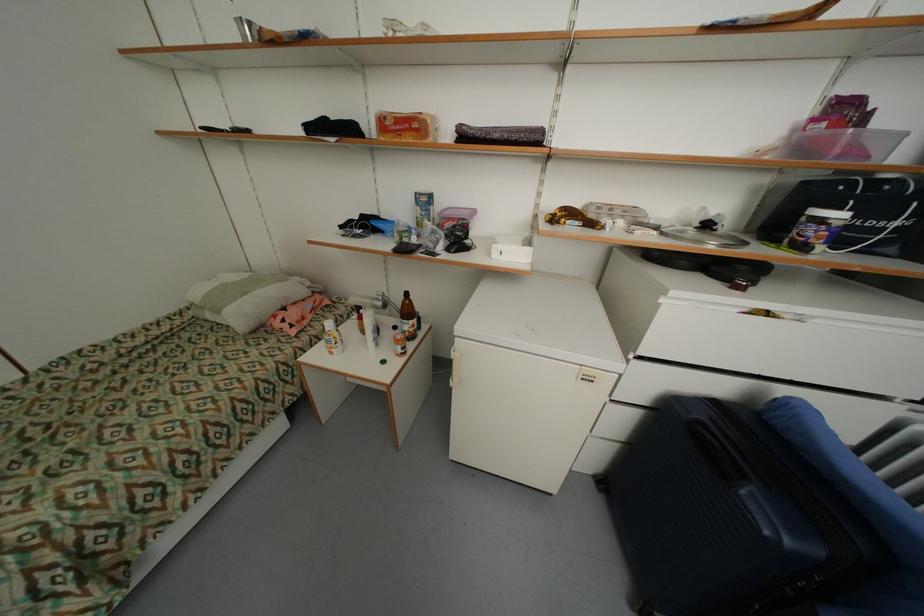
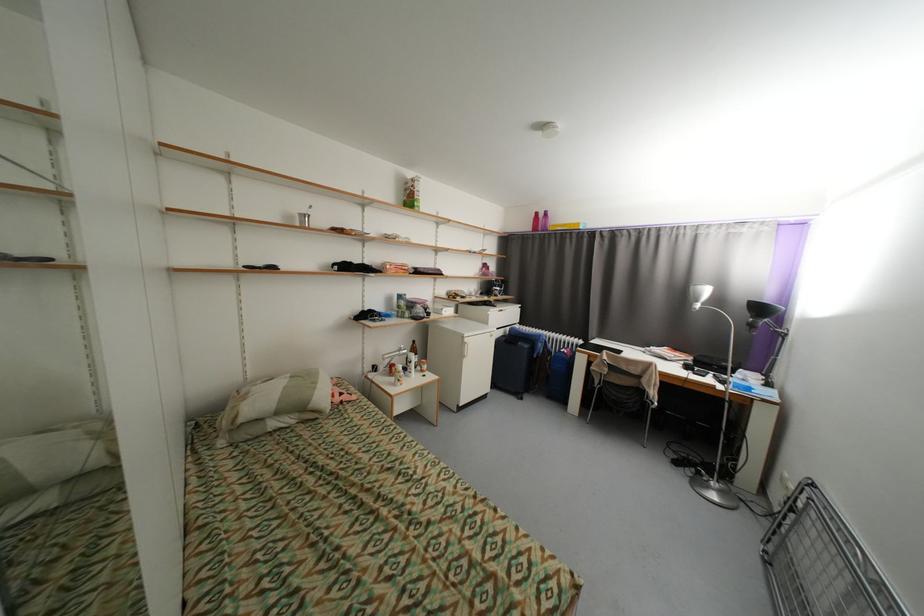
Find the pixel in the second image that matches (x=251, y=294) in the first image.

(322, 384)